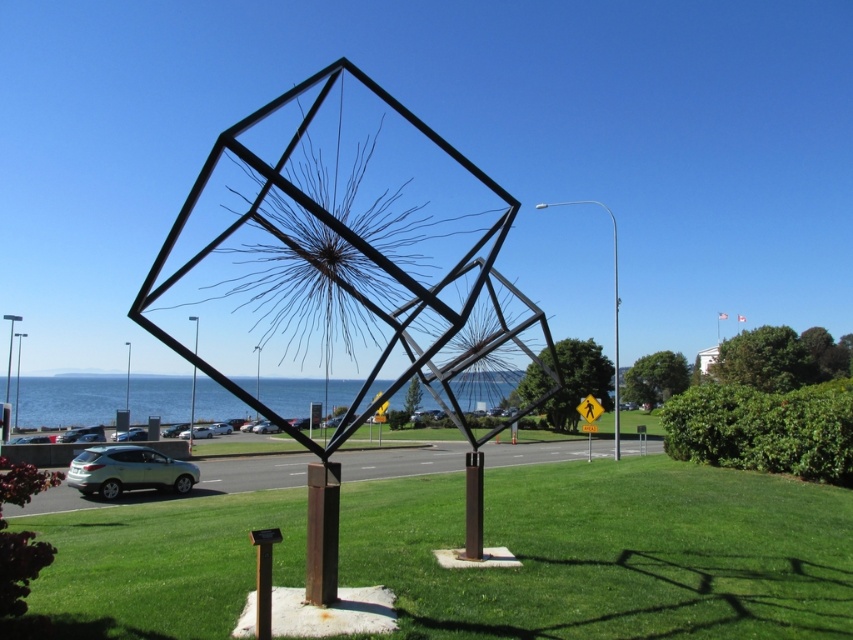
Based on the photo, does blue water at center have a larger size compared to satin silver suv at lower left?

Yes, blue water at center is bigger than satin silver suv at lower left.

Can you confirm if blue water at center is positioned to the left of satin silver suv at lower left?

Indeed, blue water at center is positioned on the left side of satin silver suv at lower left.

Between point (152, 380) and point (88, 451), which one is positioned in front?

Point (88, 451) is in front.

Identify the location of blue water at center. The width and height of the screenshot is (853, 640). (68, 400).

Image resolution: width=853 pixels, height=640 pixels. Describe the element at coordinates (190, 410) in the screenshot. I see `black metal pole at center` at that location.

Who is shorter, black metal pole at center or metallic pole at center?

metallic pole at center

Is point (189, 433) positioned before point (15, 403)?

Yes.

Find the location of a particular element. black metal pole at center is located at coordinates (190, 410).

Can you confirm if green grass at center is positioned below black metal pole at center?

No.

Locate an element on the screen. The image size is (853, 640). green grass at center is located at coordinates (608, 552).